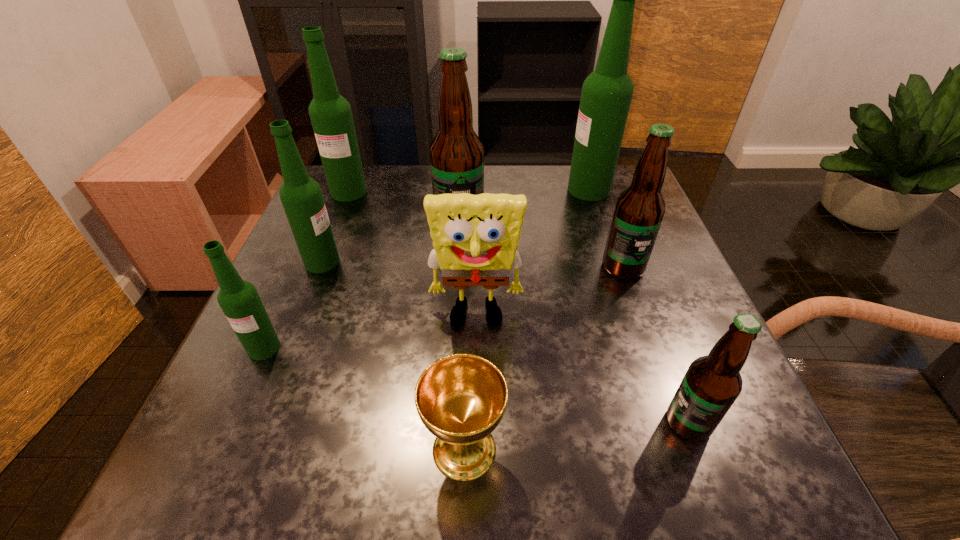
Where is `object that is at the far right corner`? The width and height of the screenshot is (960, 540). object that is at the far right corner is located at coordinates (606, 95).

Where is `object present at the near right corner`? object present at the near right corner is located at coordinates (712, 383).

The image size is (960, 540). Find the location of `free space at the far edge of the desktop`. free space at the far edge of the desktop is located at coordinates (422, 184).

At what (x,y) coordinates should I click in order to perform the action: click on blank space at the near edge of the desktop. Please return your answer as a coordinate pair (x, y). Looking at the image, I should click on (553, 484).

At what (x,y) coordinates should I click in order to perform the action: click on vacant space at the left edge. Please return your answer as a coordinate pair (x, y). Looking at the image, I should click on (336, 239).

In the image, there is a desktop. Find the location of `free region at the right edge`. free region at the right edge is located at coordinates (668, 396).

Identify the location of vacant region at the far left corner of the desktop. point(322,182).

Identify the location of free location at the near left corner. Image resolution: width=960 pixels, height=540 pixels. (251, 457).

Find the location of `free point between the sponge and the second farthest brown beer bottle`. free point between the sponge and the second farthest brown beer bottle is located at coordinates (549, 292).

Find the location of a particular element. free space between the nearest beer bottle and the chalice is located at coordinates (576, 436).